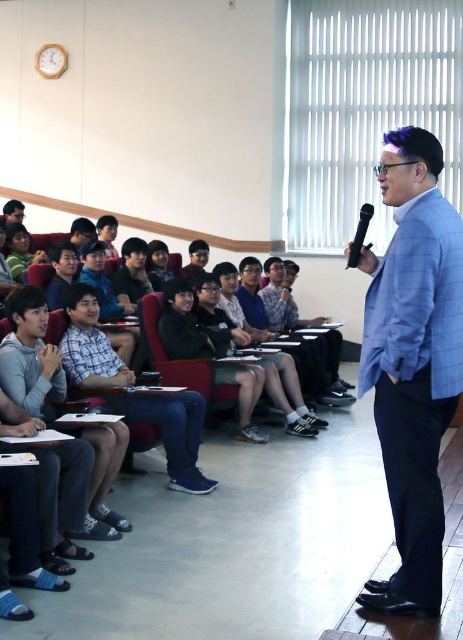
In the classroom scene, there are two blue items, the blue casual shirt at center and the blue fabric jacket at upper right. Which one is positioned more to the left side of the image?

The blue casual shirt at center is positioned to the left of the blue fabric jacket at upper right, so the blue casual shirt at center is more to the left.

You are standing in the classroom and want to take a photo of both point [437,205] and point [371,209]. Which point should you focus on first to ensure both are in clear view?

You should focus on point [437,205] first because it is closer to the camera than point [371,209]. This ensures both points are within the depth of field for clear visibility.

You are a student sitting in the back row of the classroom. You need to hand a note to the speaker wearing the blue plaid blazer at center. The note is too big to throw, so you decide to walk to the front. However, there are chairs in your way. Considering the black plastic microphone at center is on the podium, can you step around the microphone to reach the speaker without disturbing the setup?

The blue plaid blazer at center is taller than the black plastic microphone at center, which means the speaker is standing behind the microphone. You can step around the black plastic microphone at center to reach the speaker since the microphone is part of the podium setup and the speaker is in front of it.